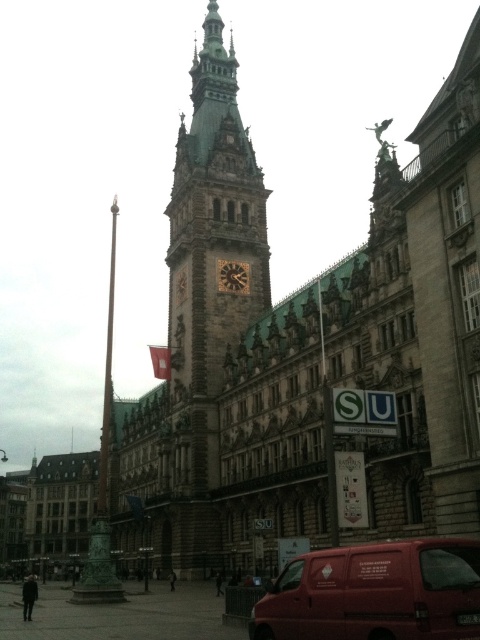
Question: Estimate the real-world distances between objects in this image. Which object is farther from the matte red van at lower right?

Choices:
 (A) gold textured clock at center
 (B) silky red flag at center
 (C) brown stone clock tower at center

Answer: (B)

Question: Estimate the real-world distances between objects in this image. Which object is farther from the matte red van at lower right?

Choices:
 (A) gold textured clock at center
 (B) brown stone clock tower at center

Answer: (A)

Question: Is matte red van at lower right to the right of gold textured clock at center from the viewer's perspective?

Choices:
 (A) yes
 (B) no

Answer: (A)

Question: Does matte red van at lower right appear on the right side of gold textured clock at center?

Choices:
 (A) yes
 (B) no

Answer: (A)

Question: Which object is positioned farthest from the brown stone clock tower at center?

Choices:
 (A) silky red flag at center
 (B) matte red van at lower right

Answer: (B)

Question: In this image, where is brown stone clock tower at center located relative to matte red van at lower right?

Choices:
 (A) above
 (B) below

Answer: (A)